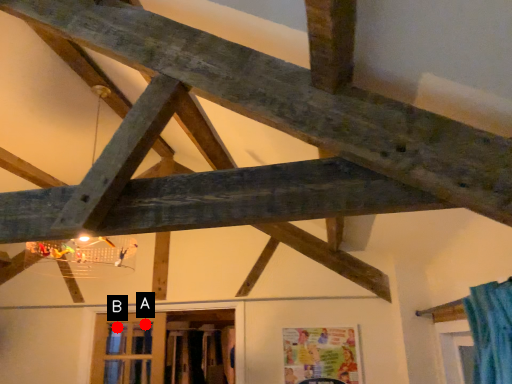
Question: Two points are circled on the image, labeled by A and B beside each circle. Among these points, which one is farthest from the camera?

Choices:
 (A) A is further
 (B) B is further

Answer: (B)